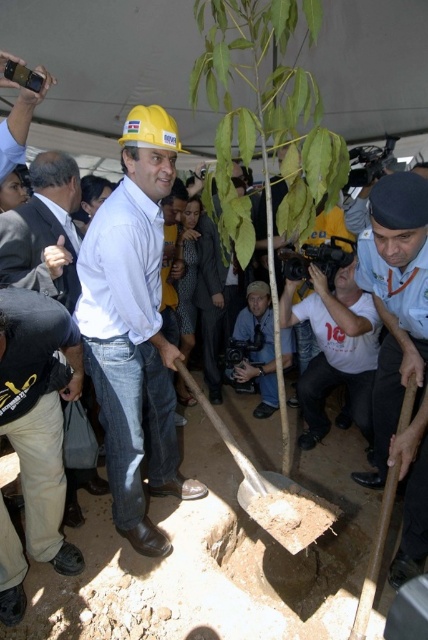
Question: Which point appears farthest from the camera in this image?

Choices:
 (A) (168, 408)
 (B) (264, 161)

Answer: (A)

Question: Does matte black camera at lower center lie in front of brown wooden shovel at center?

Choices:
 (A) no
 (B) yes

Answer: (A)

Question: Which object appears farthest from the camera in this image?

Choices:
 (A) white cotton shirt at center
 (B) blue uniform at lower right
 (C) green leafy tree at center

Answer: (A)

Question: Is white cotton shirt at center to the right of wooden shovel at center from the viewer's perspective?

Choices:
 (A) yes
 (B) no

Answer: (A)

Question: Is wooden shovel at center further to the viewer compared to matte black camera at lower center?

Choices:
 (A) no
 (B) yes

Answer: (A)

Question: Based on their relative distances, which object is nearer to the white matte shirt at center?

Choices:
 (A) matte black camera at lower center
 (B) wooden shovel at center
 (C) dark gray suit at center

Answer: (C)